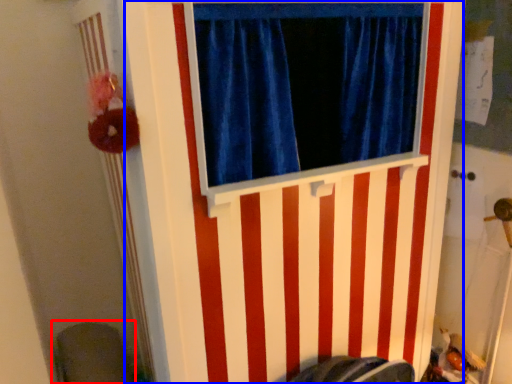
Question: Which of the following is the farthest to the observer, swivel chair (highlighted by a red box) or barn door (highlighted by a blue box)?

Choices:
 (A) swivel chair
 (B) barn door

Answer: (A)